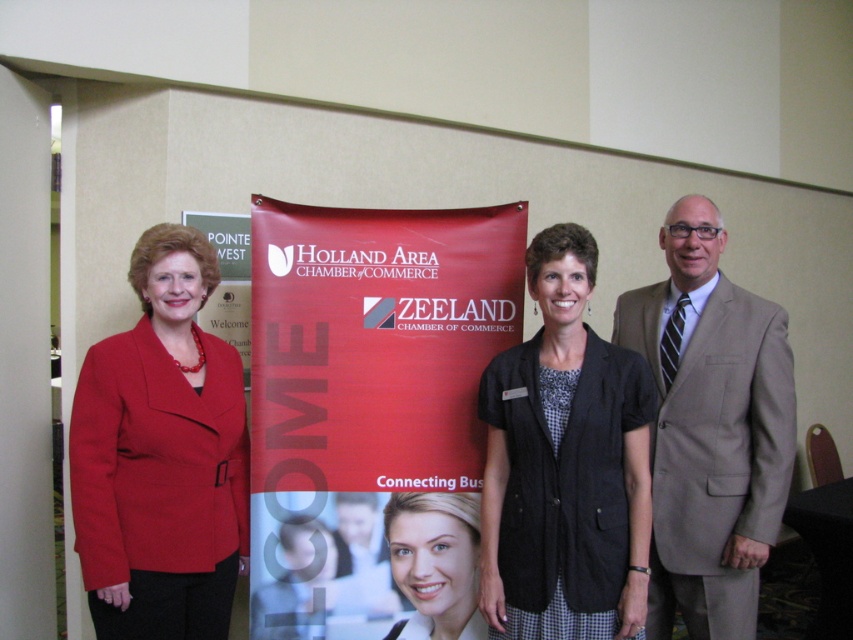
Question: Is black textured vest at center closer to the viewer compared to light brown suit at center?

Choices:
 (A) yes
 (B) no

Answer: (A)

Question: Among these points, which one is farthest from the camera?

Choices:
 (A) (242, 490)
 (B) (368, 632)
 (C) (706, 572)
 (D) (444, 541)

Answer: (D)

Question: Can you confirm if matte red blazer at left is positioned below light brown suit at center?

Choices:
 (A) no
 (B) yes

Answer: (B)

Question: Estimate the real-world distances between objects in this image. Which object is closer to the light brown suit at center?

Choices:
 (A) black textured vest at center
 (B) smooth beige blouse at center
 (C) matte red blazer at left
 (D) red matte banner at center

Answer: (A)

Question: Does red matte banner at center appear under matte red blazer at left?

Choices:
 (A) yes
 (B) no

Answer: (B)

Question: Among these objects, which one is nearest to the camera?

Choices:
 (A) light brown suit at center
 (B) red matte banner at center

Answer: (A)